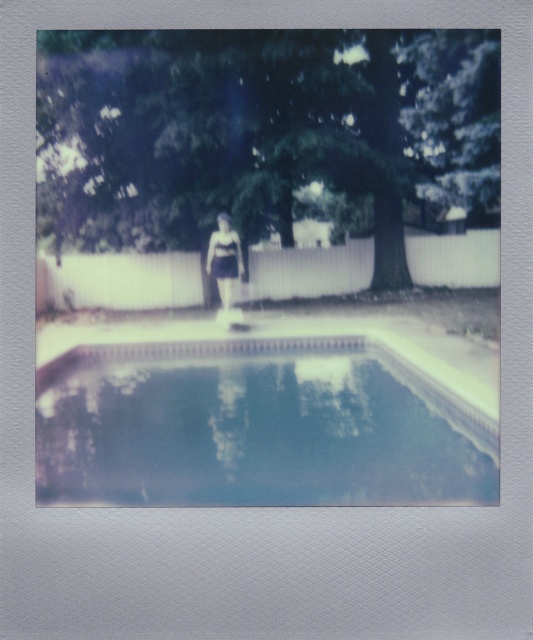
Question: Observing the image, what is the correct spatial positioning of clear glass swimming pool at center in reference to matte black swimsuit at center?

Choices:
 (A) left
 (B) right

Answer: (B)

Question: Is clear glass swimming pool at center positioned at the back of matte black swimsuit at center?

Choices:
 (A) no
 (B) yes

Answer: (A)

Question: Which of the following is the closest to the observer?

Choices:
 (A) clear glass swimming pool at center
 (B) matte black swimsuit at center

Answer: (A)

Question: Among these objects, which one is farthest from the camera?

Choices:
 (A) matte black swimsuit at center
 (B) clear glass swimming pool at center

Answer: (A)

Question: Which object is farther from the camera taking this photo?

Choices:
 (A) clear glass swimming pool at center
 (B) matte black swimsuit at center

Answer: (B)

Question: Is clear glass swimming pool at center in front of matte black swimsuit at center?

Choices:
 (A) yes
 (B) no

Answer: (A)